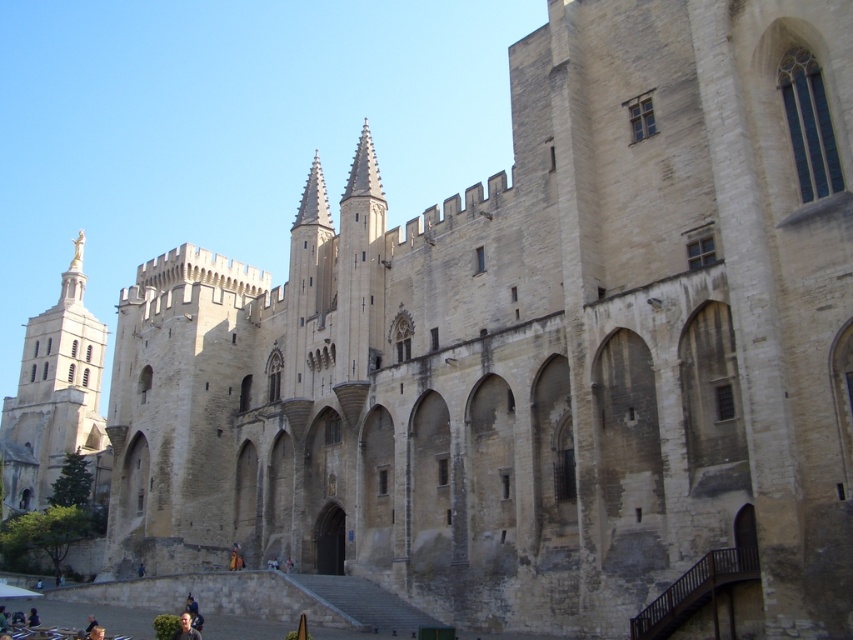
Question: Does golden statue at left appear over light brown leather jacket at lower center?

Choices:
 (A) no
 (B) yes

Answer: (B)

Question: Which object appears farthest from the camera in this image?

Choices:
 (A) light brown leather jacket at lower center
 (B) golden statue at left

Answer: (B)

Question: Among these points, which one is farthest from the camera?

Choices:
 (A) pyautogui.click(x=196, y=630)
 (B) pyautogui.click(x=20, y=480)

Answer: (B)

Question: Is golden statue at left below light brown leather jacket at lower center?

Choices:
 (A) no
 (B) yes

Answer: (A)

Question: Is golden statue at left bigger than light brown leather jacket at lower center?

Choices:
 (A) no
 (B) yes

Answer: (B)